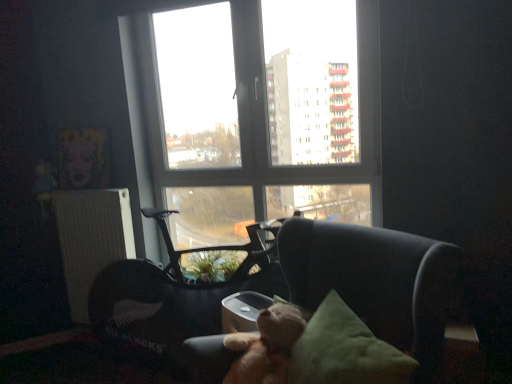
Question: Should I look upward or downward to see light brown plush at center?

Choices:
 (A) down
 (B) up

Answer: (A)

Question: Does green fabric pillow at center appear on the right side of transparent glass window at center?

Choices:
 (A) yes
 (B) no

Answer: (A)

Question: From a real-world perspective, does green fabric pillow at center stand above transparent glass window at center?

Choices:
 (A) no
 (B) yes

Answer: (A)

Question: Can you confirm if green fabric pillow at center is taller than transparent glass window at center?

Choices:
 (A) yes
 (B) no

Answer: (B)

Question: Can you confirm if green fabric pillow at center is smaller than transparent glass window at center?

Choices:
 (A) no
 (B) yes

Answer: (B)

Question: Is transparent glass window at center at the back of green fabric pillow at center?

Choices:
 (A) yes
 (B) no

Answer: (B)

Question: From the image's perspective, is green fabric pillow at center located above transparent glass window at center?

Choices:
 (A) yes
 (B) no

Answer: (B)

Question: Is black plastic swivel chair at center aimed at white textured radiator at left?

Choices:
 (A) no
 (B) yes

Answer: (A)

Question: Is black plastic swivel chair at center oriented away from white textured radiator at left?

Choices:
 (A) no
 (B) yes

Answer: (B)

Question: From the image's perspective, is black plastic swivel chair at center located above white textured radiator at left?

Choices:
 (A) yes
 (B) no

Answer: (B)

Question: Does black plastic swivel chair at center appear on the right side of white textured radiator at left?

Choices:
 (A) no
 (B) yes

Answer: (B)

Question: Is the surface of black plastic swivel chair at center in direct contact with white textured radiator at left?

Choices:
 (A) yes
 (B) no

Answer: (B)

Question: Can you confirm if black plastic swivel chair at center is positioned to the left of white textured radiator at left?

Choices:
 (A) yes
 (B) no

Answer: (B)

Question: Is white textured radiator at left wider than green fabric pillow at center?

Choices:
 (A) yes
 (B) no

Answer: (B)